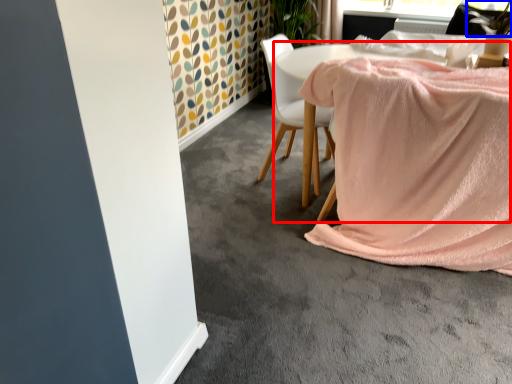
Question: Which object is closer to the camera taking this photo, table (highlighted by a red box) or plant (highlighted by a blue box)?

Choices:
 (A) table
 (B) plant

Answer: (A)